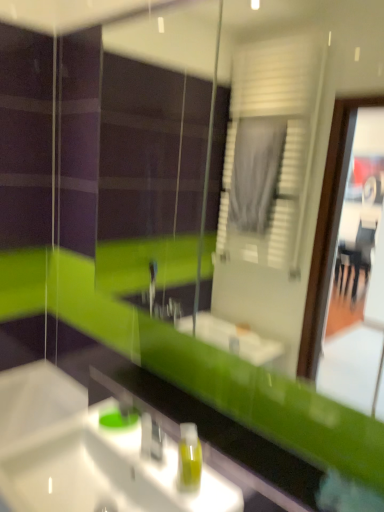
Question: Considering the relative positions of teal glass soap dispenser at center and green translucent soap dispenser at lower center in the image provided, is teal glass soap dispenser at center behind green translucent soap dispenser at lower center?

Choices:
 (A) no
 (B) yes

Answer: (B)

Question: Can you confirm if teal glass soap dispenser at center is smaller than green translucent soap dispenser at lower center?

Choices:
 (A) no
 (B) yes

Answer: (B)

Question: Considering the relative sizes of teal glass soap dispenser at center and green translucent soap dispenser at lower center in the image provided, is teal glass soap dispenser at center wider than green translucent soap dispenser at lower center?

Choices:
 (A) yes
 (B) no

Answer: (A)

Question: Is teal glass soap dispenser at center looking in the opposite direction of green translucent soap dispenser at lower center?

Choices:
 (A) yes
 (B) no

Answer: (B)

Question: Can you confirm if teal glass soap dispenser at center is thinner than green translucent soap dispenser at lower center?

Choices:
 (A) no
 (B) yes

Answer: (A)

Question: Visually, is teal glass soap dispenser at center positioned to the left or to the right of green translucent soap dispenser at lower center?

Choices:
 (A) left
 (B) right

Answer: (A)

Question: From a real-world perspective, is teal glass soap dispenser at center positioned above or below green translucent soap dispenser at lower center?

Choices:
 (A) below
 (B) above

Answer: (A)

Question: Which is correct: teal glass soap dispenser at center is inside green translucent soap dispenser at lower center, or outside of it?

Choices:
 (A) inside
 (B) outside

Answer: (B)

Question: Is teal glass soap dispenser at center in front of or behind green translucent soap dispenser at lower center in the image?

Choices:
 (A) behind
 (B) front

Answer: (A)

Question: Considering their positions, is white glossy sink at lower left located in front of or behind teal glass soap dispenser at center?

Choices:
 (A) front
 (B) behind

Answer: (A)

Question: Does point (110, 501) appear closer or farther from the camera than point (137, 413)?

Choices:
 (A) closer
 (B) farther

Answer: (A)

Question: From the image's perspective, relative to teal glass soap dispenser at center, is white glossy sink at lower left above or below?

Choices:
 (A) below
 (B) above

Answer: (A)

Question: From a real-world perspective, is white glossy sink at lower left above or below teal glass soap dispenser at center?

Choices:
 (A) below
 (B) above

Answer: (A)

Question: Relative to green translucent soap dispenser at lower center, is white glossy sink at lower left in front or behind?

Choices:
 (A) behind
 (B) front

Answer: (B)

Question: Is point (31, 402) positioned closer to the camera than point (193, 466)?

Choices:
 (A) farther
 (B) closer

Answer: (A)